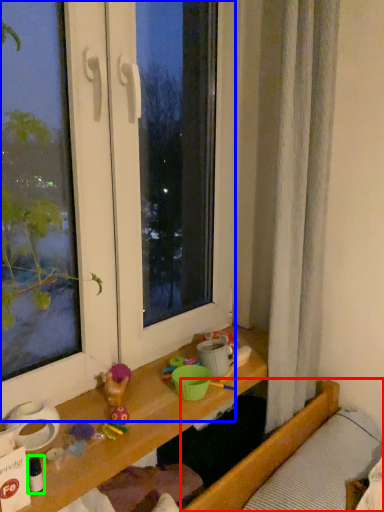
Question: Which is farther away from bed (highlighted by a red box)? window (highlighted by a blue box) or toy (highlighted by a green box)?

Choices:
 (A) window
 (B) toy

Answer: (B)